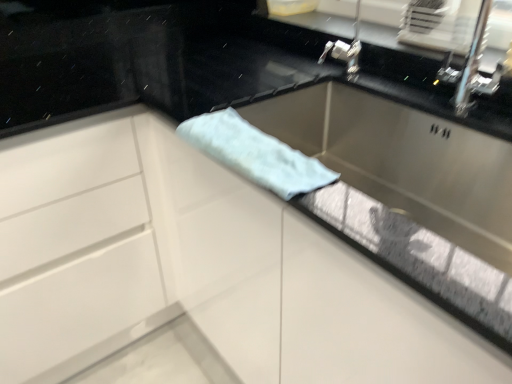
Question: Is point (203, 228) closer or farther from the camera than point (273, 140)?

Choices:
 (A) closer
 (B) farther

Answer: (B)

Question: Is white glossy cabinet at left inside or outside of light blue fabric at center?

Choices:
 (A) outside
 (B) inside

Answer: (A)

Question: Visually, is white glossy cabinet at left positioned to the left or to the right of light blue fabric at center?

Choices:
 (A) left
 (B) right

Answer: (A)

Question: Is point (260, 132) closer or farther from the camera than point (96, 238)?

Choices:
 (A) closer
 (B) farther

Answer: (A)

Question: Is light blue fabric at center inside the boundaries of white glossy cabinet at left, or outside?

Choices:
 (A) inside
 (B) outside

Answer: (B)

Question: From a real-world perspective, is light blue fabric at center physically located above or below white glossy cabinet at left?

Choices:
 (A) below
 (B) above

Answer: (B)

Question: Considering the relative positions of light blue fabric at center and white glossy cabinet at left in the image provided, is light blue fabric at center to the left or to the right of white glossy cabinet at left?

Choices:
 (A) right
 (B) left

Answer: (A)